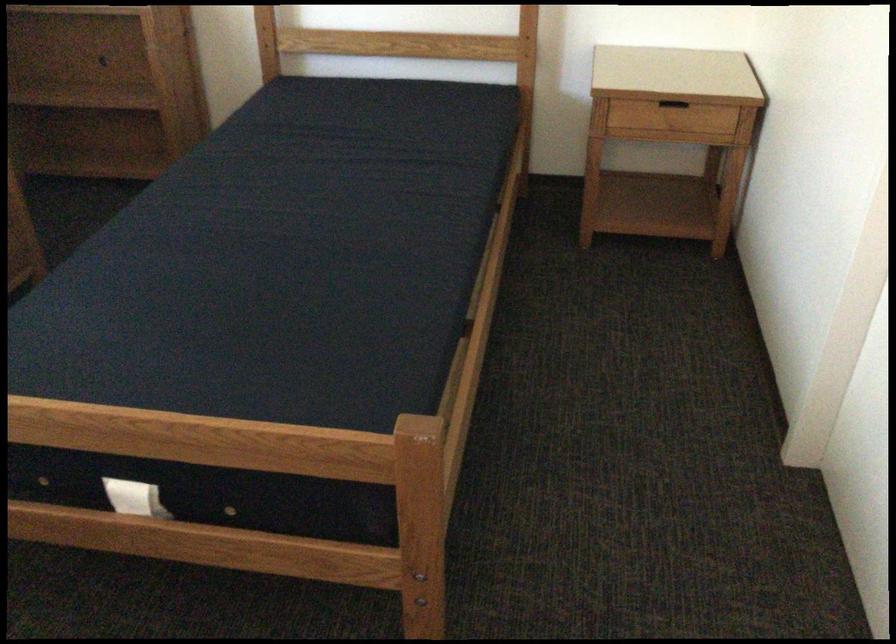
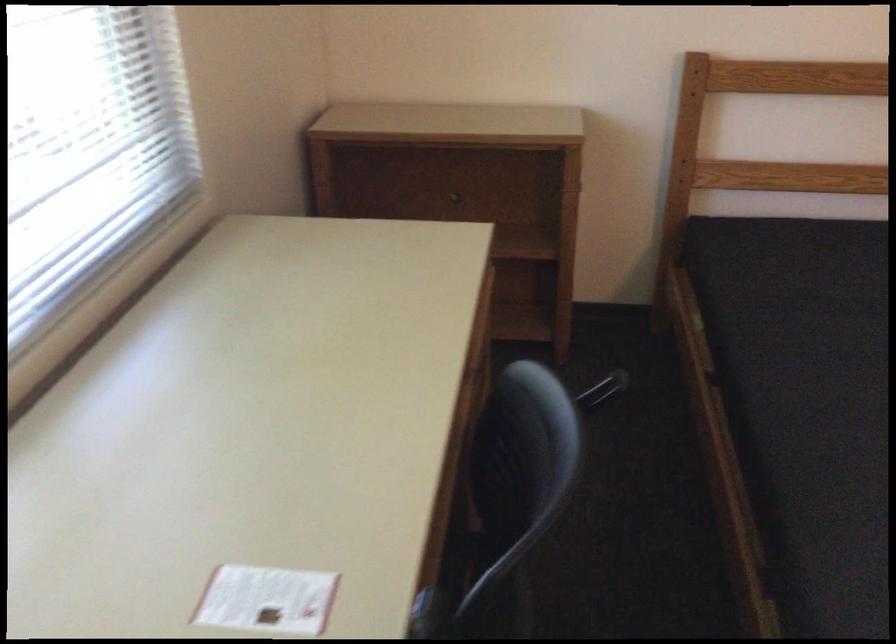
The images are taken continuously from a first-person perspective. In which direction are you moving?

The cameraman moved toward left, forward.